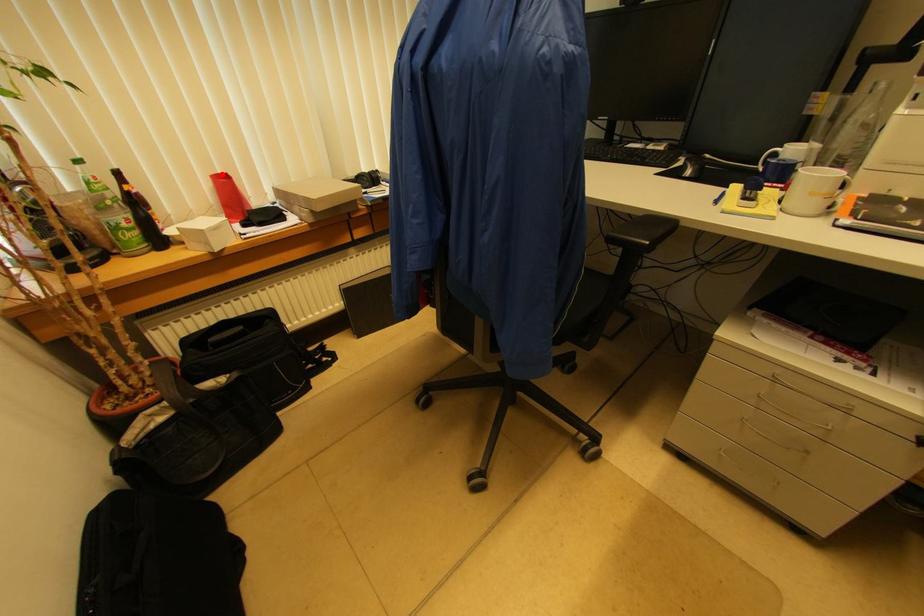
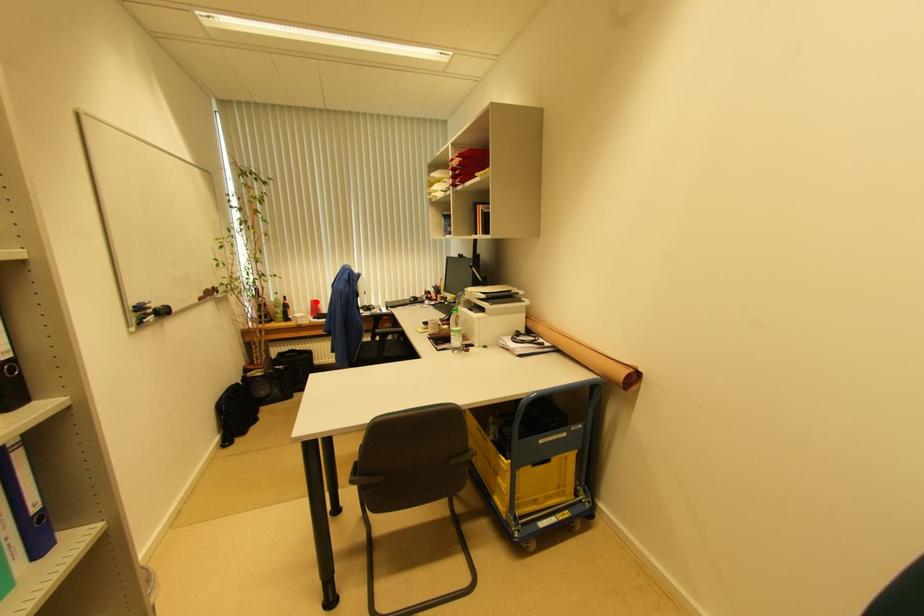
I am providing you with two images of the same scene from different viewpoints. A red point is marked on the first image and another point is marked on the second image. Does the point marked in image1 correspond to the same location as the one in image2?

Yes